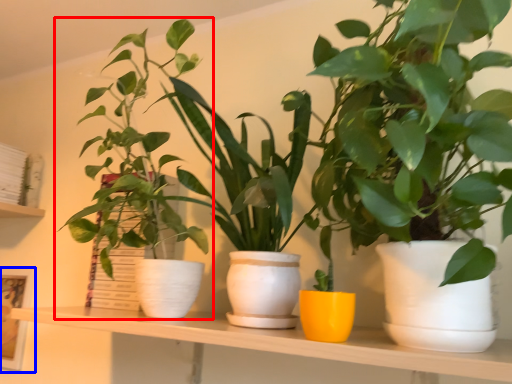
Question: Which object appears closest to the camera in this image, houseplant (highlighted by a red box) or picture frame (highlighted by a blue box)?

Choices:
 (A) houseplant
 (B) picture frame

Answer: (A)